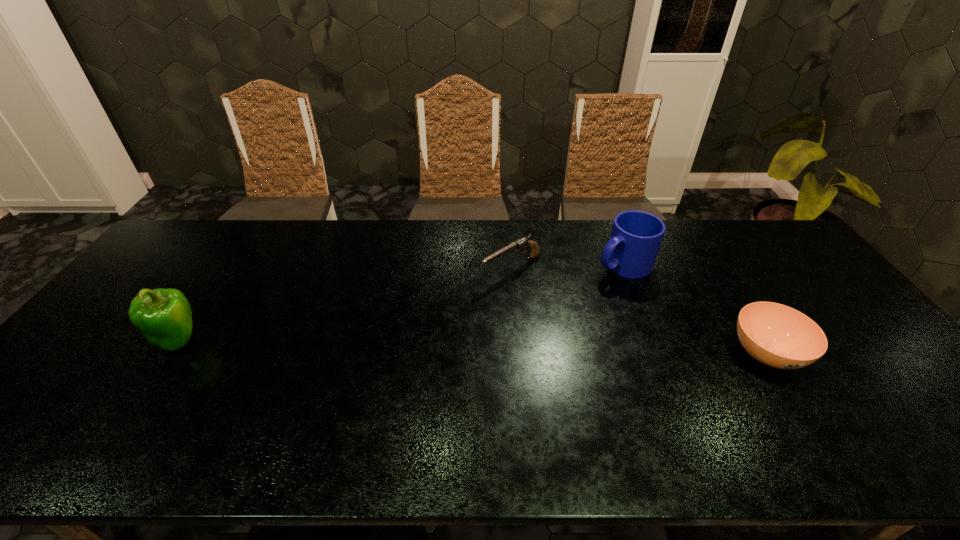
This screenshot has height=540, width=960. I want to click on vacant space situated 0.080m aiming along the barrel of the gun, so click(x=468, y=293).

You are a GUI agent. You are given a task and a screenshot of the screen. Output one action in this format:
    pyautogui.click(x=<x>, y=<y>)
    Task: Click on the vacant area situated on the side with the handle of the mug
    The width and height of the screenshot is (960, 540).
    Given the screenshot: What is the action you would take?
    pyautogui.click(x=510, y=321)

I want to click on vacant space situated 0.330m on the side with the handle of the mug, so click(518, 316).

Find the location of a particular element. The height and width of the screenshot is (540, 960). blank space located 0.210m on the side with the handle of the mug is located at coordinates (550, 300).

Where is `gun located in the far edge section of the desktop`? The image size is (960, 540). gun located in the far edge section of the desktop is located at coordinates (523, 243).

Identify the location of mug positioned at the far edge. (636, 236).

Image resolution: width=960 pixels, height=540 pixels. I want to click on free region at the far edge of the desktop, so click(390, 231).

Find the location of a particular element. free space at the near edge of the desktop is located at coordinates (314, 413).

Locate an element on the screen. vacant region at the left edge of the desktop is located at coordinates (185, 268).

In the image, there is a desktop. What are the coordinates of `vacant space at the right edge` in the screenshot? It's located at point(803,271).